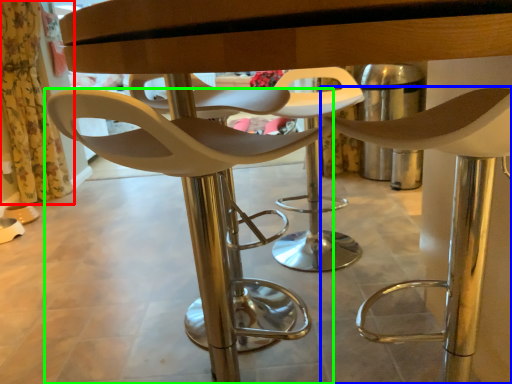
Question: Estimate the real-world distances between objects in this image. Which object is closer to curtain (highlighted by a red box), chair (highlighted by a blue box) or chair (highlighted by a green box)?

Choices:
 (A) chair
 (B) chair

Answer: (B)